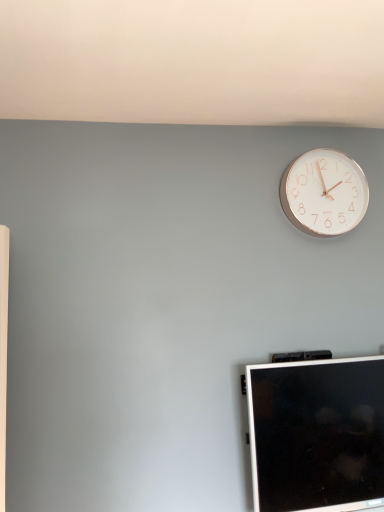
Find the location of `black glossy monitor at lower right`. black glossy monitor at lower right is located at coordinates (317, 434).

Describe the element at coordinates (317, 434) in the screenshot. This screenshot has height=512, width=384. I see `black glossy monitor at lower right` at that location.

Locate an element on the screen. The image size is (384, 512). white metallic clock at upper right is located at coordinates (324, 193).

Describe the element at coordinates (324, 193) in the screenshot. I see `white metallic clock at upper right` at that location.

The width and height of the screenshot is (384, 512). I want to click on black glossy monitor at lower right, so click(317, 434).

Between white metallic clock at upper right and black glossy monitor at lower right, which one appears on the left side from the viewer's perspective?

black glossy monitor at lower right is more to the left.

Does white metallic clock at upper right lie in front of black glossy monitor at lower right?

No, the depth of white metallic clock at upper right is greater than that of black glossy monitor at lower right.

Which is farther from the camera, (323, 197) or (321, 422)?

Point (323, 197)

From the image's perspective, is white metallic clock at upper right located above or below black glossy monitor at lower right?

Based on their image positions, white metallic clock at upper right is located above black glossy monitor at lower right.

From a real-world perspective, between white metallic clock at upper right and black glossy monitor at lower right, who is vertically lower?

From a 3D spatial view, black glossy monitor at lower right is below.

Based on the photo, between white metallic clock at upper right and black glossy monitor at lower right, which one has larger width?

With larger width is black glossy monitor at lower right.

Considering the sizes of objects white metallic clock at upper right and black glossy monitor at lower right in the image provided, who is taller, white metallic clock at upper right or black glossy monitor at lower right?

black glossy monitor at lower right is taller.

Between white metallic clock at upper right and black glossy monitor at lower right, which one has larger size?

black glossy monitor at lower right.

Is white metallic clock at upper right situated inside black glossy monitor at lower right or outside?

white metallic clock at upper right is located beyond the bounds of black glossy monitor at lower right.

Is white metallic clock at upper right directly adjacent to black glossy monitor at lower right?

No, white metallic clock at upper right is not making contact with black glossy monitor at lower right.

Could you tell me if white metallic clock at upper right is turned towards black glossy monitor at lower right?

No, white metallic clock at upper right is not turned towards black glossy monitor at lower right.

How different are the orientations of white metallic clock at upper right and black glossy monitor at lower right in degrees?

There is a 1.87-degree angle between the facing directions of white metallic clock at upper right and black glossy monitor at lower right.

How much distance is there between white metallic clock at upper right and black glossy monitor at lower right?

white metallic clock at upper right and black glossy monitor at lower right are 60.93 centimeters apart from each other.

This screenshot has height=512, width=384. I want to click on wall clock behind the black glossy monitor at lower right, so click(x=324, y=193).

Consider the image. Can you confirm if black glossy monitor at lower right is positioned to the right of white metallic clock at upper right?

No.

Considering the relative positions of black glossy monitor at lower right and white metallic clock at upper right in the image provided, is black glossy monitor at lower right behind white metallic clock at upper right?

That is False.

Considering the points (251, 448) and (334, 233), which point is behind, point (251, 448) or point (334, 233)?

The point (334, 233) is behind.

From the image's perspective, is black glossy monitor at lower right above or below white metallic clock at upper right?

Based on their image positions, black glossy monitor at lower right is located beneath white metallic clock at upper right.

From a real-world perspective, which is physically below, black glossy monitor at lower right or white metallic clock at upper right?

black glossy monitor at lower right, from a real-world perspective.

Which object is thinner, black glossy monitor at lower right or white metallic clock at upper right?

white metallic clock at upper right is thinner.

Between black glossy monitor at lower right and white metallic clock at upper right, which one has more height?

Standing taller between the two is black glossy monitor at lower right.

Between black glossy monitor at lower right and white metallic clock at upper right, which one has larger size?

black glossy monitor at lower right is bigger.

Choose the correct answer: Is black glossy monitor at lower right inside white metallic clock at upper right or outside it?

black glossy monitor at lower right cannot be found inside white metallic clock at upper right.

Are black glossy monitor at lower right and white metallic clock at upper right far apart?

No, there isn't a large distance between black glossy monitor at lower right and white metallic clock at upper right.

Is black glossy monitor at lower right aimed at white metallic clock at upper right?

No, black glossy monitor at lower right does not turn towards white metallic clock at upper right.

Find the location of a particular element. computer monitor in front of the white metallic clock at upper right is located at coordinates click(317, 434).

This screenshot has height=512, width=384. I want to click on wall clock that is on the right side of black glossy monitor at lower right, so click(324, 193).

The height and width of the screenshot is (512, 384). What are the coordinates of `computer monitor on the left of white metallic clock at upper right` in the screenshot? It's located at (317, 434).